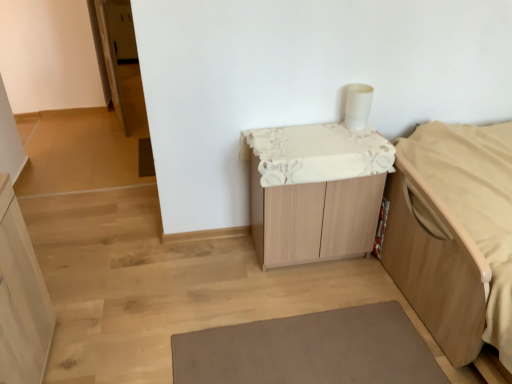
You are a GUI agent. You are given a task and a screenshot of the screen. Output one action in this format:
    pyautogui.click(x=<x>, y=<y>)
    Task: Click on the vacant point above gray matte bath mat at lower center (from a real-world perspective)
    
    Given the screenshot: What is the action you would take?
    pyautogui.click(x=303, y=357)